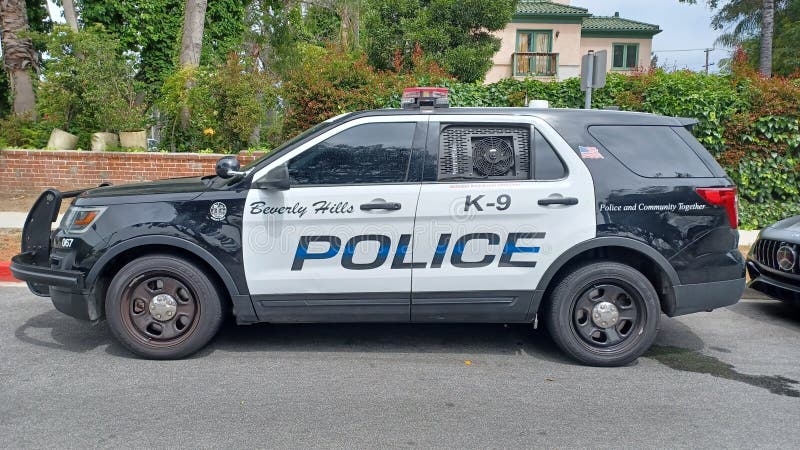
Identify the location of brick wall. (65, 170), (132, 172).